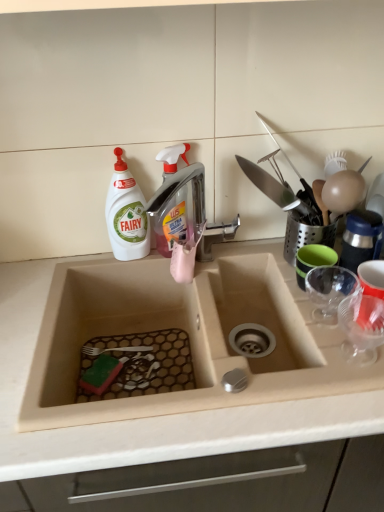
Identify the location of free space that is in between green rubber cup at right, positioned as the 3th tableware in front-to-back order, and transparent plastic cup at right, placed as the 1th tableware when sorted from front to back. The width and height of the screenshot is (384, 512). (327, 320).